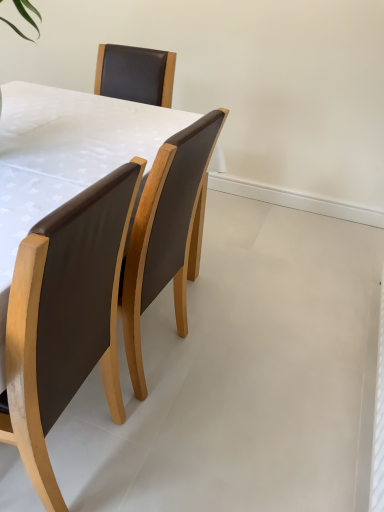
Locate an element on the screen. The width and height of the screenshot is (384, 512). brown leather table at center is located at coordinates (64, 156).

This screenshot has height=512, width=384. What do you see at coordinates (64, 156) in the screenshot?
I see `brown leather table at center` at bounding box center [64, 156].

What do you see at coordinates (65, 317) in the screenshot?
I see `brown leather chair at left` at bounding box center [65, 317].

Where is `brown leather chair at left`? The height and width of the screenshot is (512, 384). brown leather chair at left is located at coordinates (65, 317).

This screenshot has width=384, height=512. I want to click on brown leather table at center, so click(x=64, y=156).

Which object is positioned more to the right, brown leather chair at left or brown leather table at center?

brown leather table at center.

Does brown leather chair at left come behind brown leather table at center?

That is False.

Is point (25, 298) positioned after point (88, 97)?

No, it is not.

Looking at this image, from the image's perspective, does brown leather chair at left appear lower than brown leather table at center?

Indeed, from the image's perspective, brown leather chair at left is shown beneath brown leather table at center.

From a real-world perspective, which is physically above, brown leather chair at left or brown leather table at center?

brown leather chair at left is physically above.

Between brown leather chair at left and brown leather table at center, which one has smaller width?

brown leather chair at left is thinner.

Based on the photo, does brown leather chair at left have a greater height compared to brown leather table at center?

Yes, brown leather chair at left is taller than brown leather table at center.

Is brown leather chair at left bigger or smaller than brown leather table at center?

brown leather chair at left is smaller than brown leather table at center.

Is brown leather chair at left not within brown leather table at center?

Absolutely, brown leather chair at left is external to brown leather table at center.

Is brown leather chair at left placed right next to brown leather table at center?

No.

Is brown leather chair at left facing towards brown leather table at center?

No, brown leather chair at left does not turn towards brown leather table at center.

Can you tell me how much brown leather chair at left and brown leather table at center differ in facing direction?

They differ by 4.73 degrees in their facing directions.

In order to click on chair located above the brown leather table at center (from a real-world perspective) in this screenshot , I will do `click(65, 317)`.

Consider the image. Is brown leather table at center at the left side of brown leather chair at left?

No, brown leather table at center is not to the left of brown leather chair at left.

Relative to brown leather chair at left, is brown leather table at center in front or behind?

Visually, brown leather table at center is located behind brown leather chair at left.

Is point (97, 162) less distant than point (54, 216)?

No, (97, 162) is further to viewer.

Looking at this image, from the image's perspective, relative to brown leather chair at left, is brown leather table at center above or below?

brown leather table at center is situated higher than brown leather chair at left in the image.

Based on the photo, from a real-world perspective, is brown leather table at center below brown leather chair at left?

Yes, from a real-world perspective, brown leather table at center is beneath brown leather chair at left.

Is brown leather table at center wider or thinner than brown leather chair at left?

In the image, brown leather table at center appears to be wider than brown leather chair at left.

Considering the sizes of objects brown leather table at center and brown leather chair at left in the image provided, who is shorter, brown leather table at center or brown leather chair at left?

Standing shorter between the two is brown leather table at center.

Considering the relative sizes of brown leather table at center and brown leather chair at left in the image provided, is brown leather table at center smaller than brown leather chair at left?

No.

Is brown leather chair at left a part of brown leather table at center?

No, brown leather chair at left is not surrounded by brown leather table at center.

Can you see brown leather table at center touching brown leather chair at left?

No, brown leather table at center is not beside brown leather chair at left.

Is brown leather table at center oriented away from brown leather chair at left?

No, brown leather table at center's orientation is not away from brown leather chair at left.

Based on the photo, can you tell me how much brown leather table at center and brown leather chair at left differ in facing direction?

brown leather table at center and brown leather chair at left are facing 4.73 degrees away from each other.

How distant is brown leather table at center from brown leather chair at left?

The distance of brown leather table at center from brown leather chair at left is 12.99 inches.

This screenshot has width=384, height=512. What are the coordinates of `chair below the brown leather table at center (from the image's perspective)` in the screenshot? It's located at (65, 317).

The image size is (384, 512). In order to click on table above the brown leather chair at left (from the image's perspective) in this screenshot , I will do `click(64, 156)`.

The height and width of the screenshot is (512, 384). In order to click on table located underneath the brown leather chair at left (from a real-world perspective) in this screenshot , I will do `click(64, 156)`.